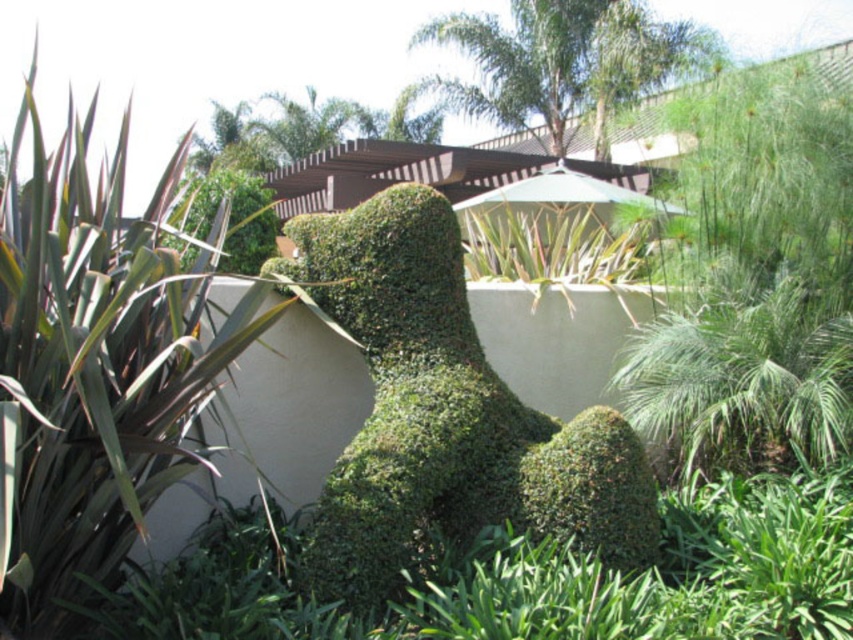
Question: Does green leafy bush at left appear on the right side of green leafy bush at center?

Choices:
 (A) yes
 (B) no

Answer: (B)

Question: Is green leafy bush at left in front of green leafy bush at center?

Choices:
 (A) yes
 (B) no

Answer: (A)

Question: Which point is farther from the camera taking this photo?

Choices:
 (A) (67, 205)
 (B) (486, 369)

Answer: (B)

Question: Can you confirm if green leafy bush at left is thinner than green leafy bush at center?

Choices:
 (A) no
 (B) yes

Answer: (B)

Question: Which of the following is the closest to the observer?

Choices:
 (A) (213, 221)
 (B) (390, 467)

Answer: (B)

Question: Among these points, which one is nearest to the camera?

Choices:
 (A) (589, 506)
 (B) (151, 244)

Answer: (B)